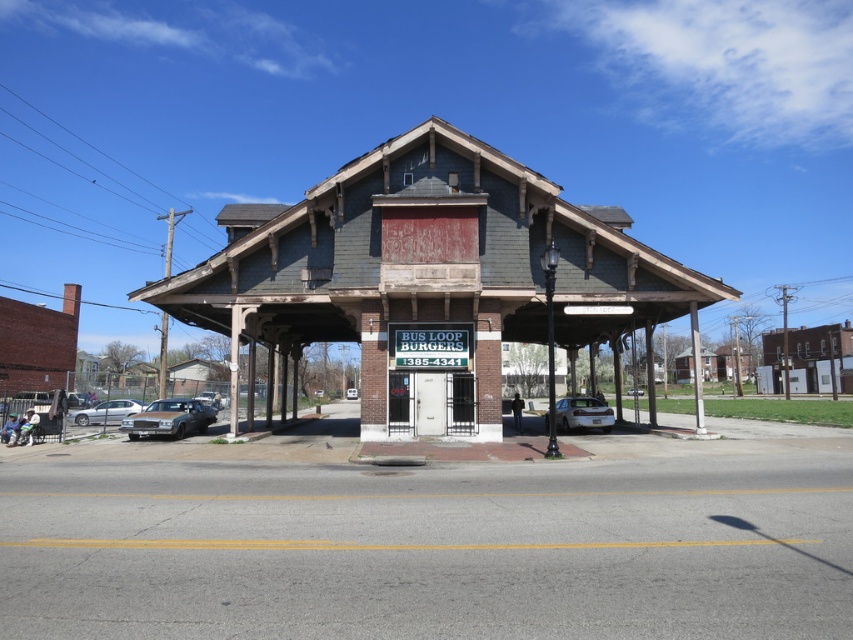
Question: Which object appears closest to the camera in this image?

Choices:
 (A) silver metallic sedan at center
 (B) silver metallic sedan at lower left
 (C) satin silver sedan at center

Answer: (C)

Question: Which point is farther from the camera taking this photo?

Choices:
 (A) (352, 396)
 (B) (134, 412)
 (C) (155, 413)

Answer: (A)

Question: Is shiny silver sedan at lower left positioned in front of satin silver sedan at center?

Choices:
 (A) yes
 (B) no

Answer: (A)

Question: Among these objects, which one is nearest to the camera?

Choices:
 (A) silver metallic sedan at lower left
 (B) silver metallic sedan at center
 (C) shiny silver sedan at lower left

Answer: (C)

Question: Is brick building at center above satin silver sedan at center?

Choices:
 (A) no
 (B) yes

Answer: (B)

Question: Observing the image, what is the correct spatial positioning of satin silver sedan at center in reference to silver metallic sedan at lower left?

Choices:
 (A) above
 (B) below

Answer: (B)